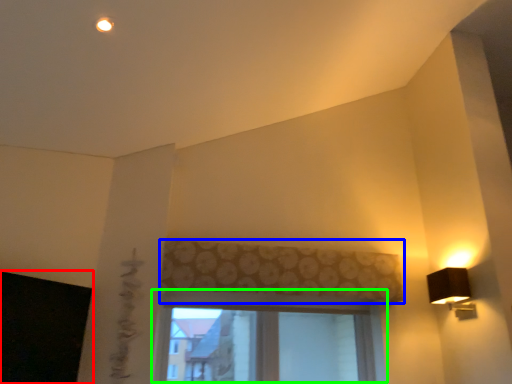
Question: Based on their relative distances, which object is nearer to window screen (highlighted by a red box)? Choose from curtain (highlighted by a blue box) and window (highlighted by a green box).

Choices:
 (A) curtain
 (B) window

Answer: (B)